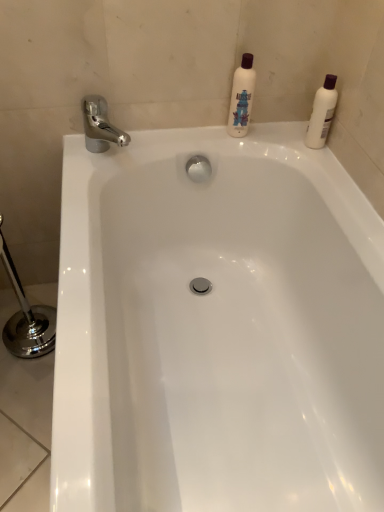
The image size is (384, 512). I want to click on vacant space in front of chrome metallic faucet at upper left, so click(x=78, y=188).